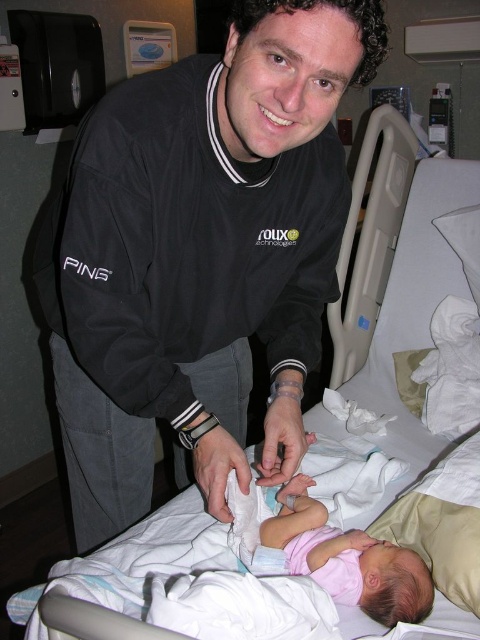
Question: Where is black soft jacket at center located in relation to pink fabric baby at center in the image?

Choices:
 (A) right
 (B) left

Answer: (B)

Question: Can you confirm if black soft jacket at center is thinner than pink fabric baby at center?

Choices:
 (A) no
 (B) yes

Answer: (A)

Question: Which object is farther from the camera taking this photo?

Choices:
 (A) pink fabric baby at center
 (B) black soft jacket at center

Answer: (A)

Question: Can you confirm if black soft jacket at center is bigger than pink fabric baby at center?

Choices:
 (A) no
 (B) yes

Answer: (B)